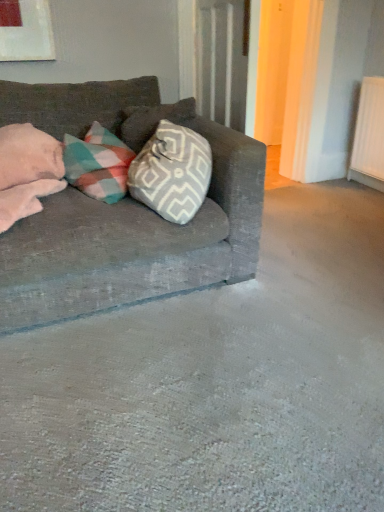
Question: From a real-world perspective, relative to textured gray couch at left, is pink soft pillow at left vertically above or below?

Choices:
 (A) above
 (B) below

Answer: (A)

Question: Choose the correct answer: Is pink soft pillow at left inside textured gray couch at left or outside it?

Choices:
 (A) outside
 (B) inside

Answer: (B)

Question: Is pink soft pillow at left wider or thinner than textured gray couch at left?

Choices:
 (A) wide
 (B) thin

Answer: (B)

Question: Is textured gray couch at left inside the boundaries of pink soft pillow at left, or outside?

Choices:
 (A) inside
 (B) outside

Answer: (B)

Question: From their relative heights in the image, would you say textured gray couch at left is taller or shorter than pink soft pillow at left?

Choices:
 (A) short
 (B) tall

Answer: (B)

Question: From the image's perspective, is textured gray couch at left positioned above or below pink soft pillow at left?

Choices:
 (A) below
 (B) above

Answer: (A)

Question: In terms of width, does textured gray couch at left look wider or thinner when compared to pink soft pillow at left?

Choices:
 (A) wide
 (B) thin

Answer: (A)